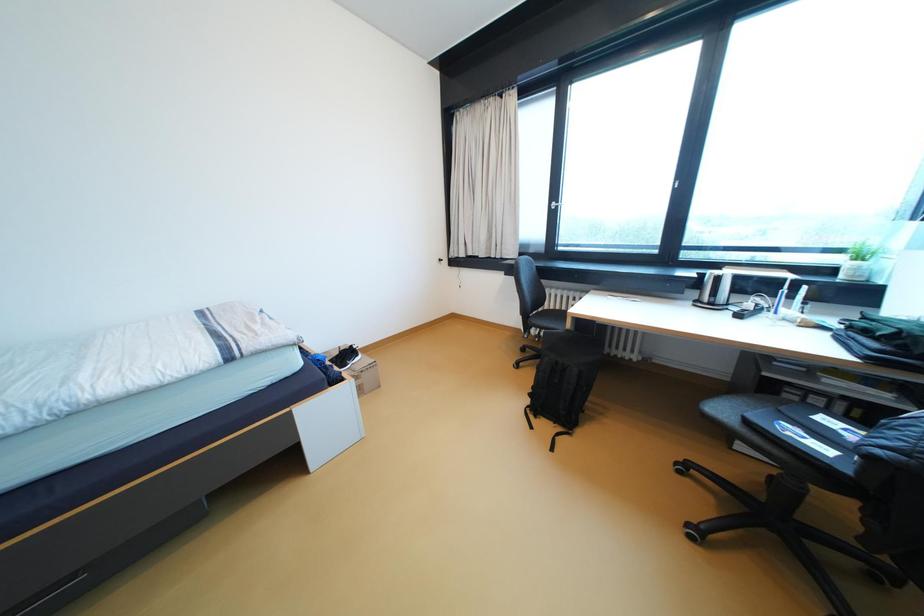
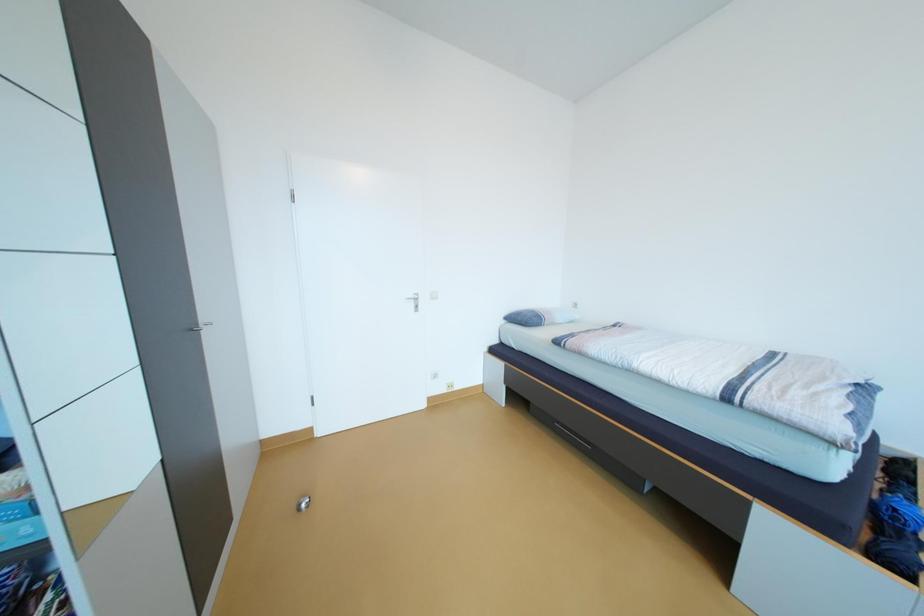
Based on the continuous images, in which direction is the camera rotating?

The camera rotated toward left-down.